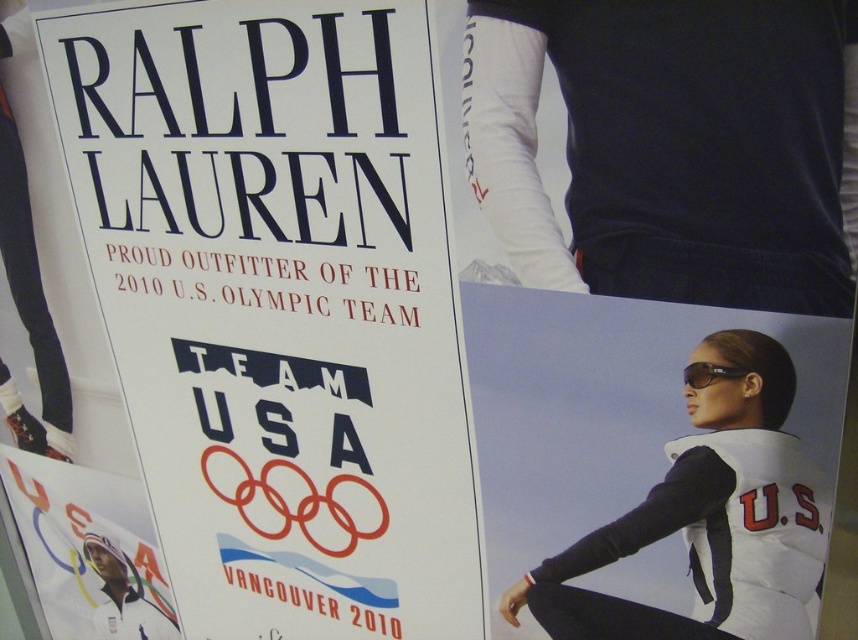
You are a GUI agent. You are given a task and a screenshot of the screen. Output one action in this format:
    pyautogui.click(x=<x>, y=<y>)
    Task: Click on the white paper at upper left
    Image resolution: width=858 pixels, height=640 pixels.
    Given the screenshot: What is the action you would take?
    pyautogui.click(x=279, y=307)

Does white paper at upper left have a larger size compared to white matte vest at center?

Yes, white paper at upper left is bigger than white matte vest at center.

Locate an element on the screen. This screenshot has width=858, height=640. white paper at upper left is located at coordinates (279, 307).

Identify the location of white paper at upper left. The width and height of the screenshot is (858, 640). (279, 307).

Does white paper at upper left come in front of white matte tights at upper center?

No, white paper at upper left is behind white matte tights at upper center.

Does white paper at upper left have a lesser width compared to white matte tights at upper center?

No.

The height and width of the screenshot is (640, 858). What do you see at coordinates (279, 307) in the screenshot?
I see `white paper at upper left` at bounding box center [279, 307].

Locate an element on the screen. This screenshot has width=858, height=640. white paper at upper left is located at coordinates click(279, 307).

Based on the photo, which is more to the left, white matte vest at center or white paper at lower left?

white paper at lower left is more to the left.

Between white matte vest at center and white paper at lower left, which one is positioned higher?

white matte vest at center is higher up.

Between point (820, 515) and point (148, 620), which one is positioned behind?

The point (148, 620) is behind.

The width and height of the screenshot is (858, 640). Find the location of `white matte vest at center`. white matte vest at center is located at coordinates (708, 518).